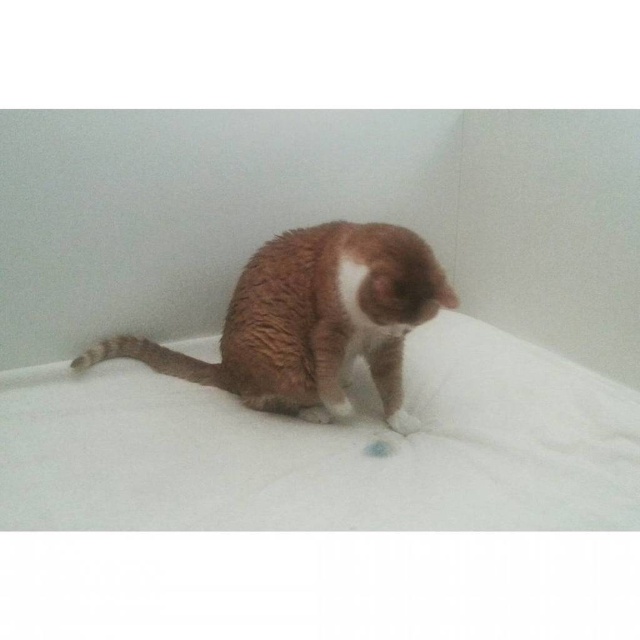
Question: Which point is closer to the camera?

Choices:
 (A) brown fur cat at center
 (B) white fur paw at lower center

Answer: (A)

Question: Does brown fur cat at center have a lesser width compared to white fur paw at lower center?

Choices:
 (A) yes
 (B) no

Answer: (B)

Question: Does brown fur cat at center lie behind white fur paw at lower center?

Choices:
 (A) no
 (B) yes

Answer: (A)

Question: Which of the following is the closest to the observer?

Choices:
 (A) white fur paw at lower center
 (B) brown fur cat at center

Answer: (B)

Question: Is brown fur cat at center further to the viewer compared to white fur paw at lower center?

Choices:
 (A) yes
 (B) no

Answer: (B)